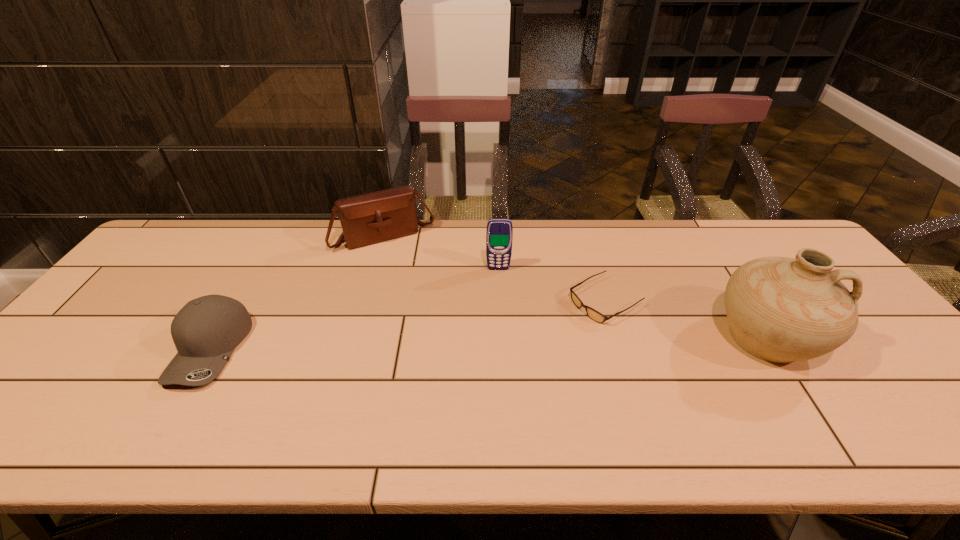
Where is `baseball cap`? The image size is (960, 540). baseball cap is located at coordinates (207, 329).

Locate an element on the screen. The image size is (960, 540). the fourth tallest object is located at coordinates (207, 329).

Where is `the tallest object`? This screenshot has width=960, height=540. the tallest object is located at coordinates (779, 309).

This screenshot has height=540, width=960. I want to click on the rightmost object, so click(x=779, y=309).

This screenshot has height=540, width=960. Identify the location of the third object from right to left. (x=499, y=234).

Locate an element on the screen. the second farthest object is located at coordinates (499, 234).

Identify the location of the shortest object. Image resolution: width=960 pixels, height=540 pixels. (593, 314).

This screenshot has height=540, width=960. I want to click on the second object from right to left, so click(x=593, y=314).

Locate an element on the screen. the fourth object from right to left is located at coordinates (370, 218).

Where is `the farthest object`? The image size is (960, 540). the farthest object is located at coordinates (370, 218).